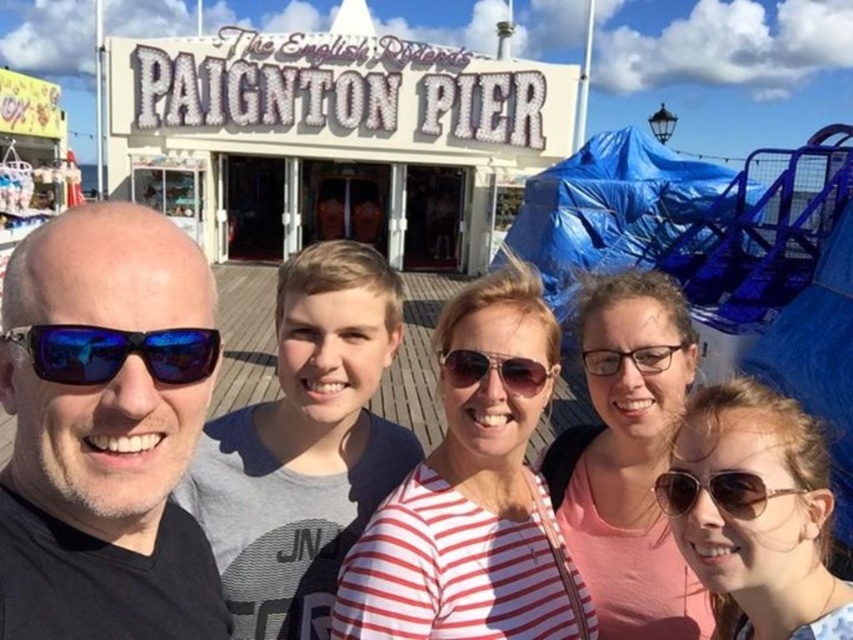
You are a photographer trying to capture a clear shot of the group at Paignton Pier. You notice two individuals wearing glasses. The man on the far left has blue reflective lens sunglasses at left, and the person at center has transparent plastic glasses at center. Which pair of glasses might cause glare and reflections in the photo, making it harder to see their eyes?

The blue reflective lens sunglasses at left has a larger size compared to transparent plastic glasses at center, so the blue reflective lens sunglasses at left might cause more glare and reflections in the photo, making it harder to see their eyes.

You are standing at the pier and want to take a selfie with the Paignton Pier sign in the background. The sign is located at point (689,492). Since you are 1.7 meters tall, will you be able to fit the entire sign into your phone camera frame if you stand 13.22 meters away?

The distance between you and the sign at point (689,492) is 13.22 meters. Given that you are 1.7 meters tall, you should be able to fit the entire sign into your phone camera frame from that distance.